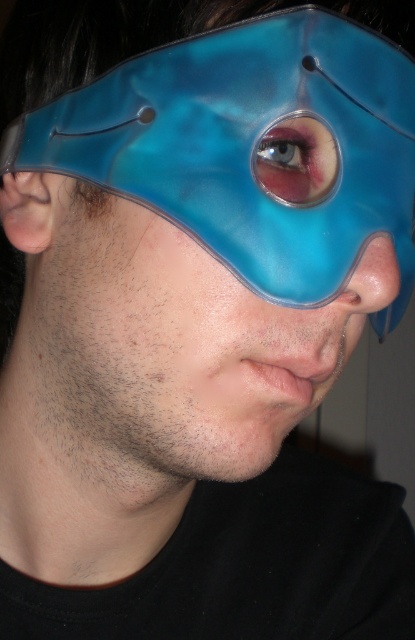
Question: Which point is farther to the camera?

Choices:
 (A) purple glossy eye at center
 (B) transparent blue mask at upper right

Answer: (A)

Question: Does transparent blue mask at upper right appear under purple glossy eye at center?

Choices:
 (A) yes
 (B) no

Answer: (A)

Question: Which object is farther from the camera taking this photo?

Choices:
 (A) transparent blue mask at upper right
 (B) purple glossy eye at center

Answer: (B)

Question: Among these points, which one is nearest to the camera?

Choices:
 (A) (305, 138)
 (B) (231, 93)

Answer: (B)

Question: Is transparent blue mask at upper right to the right of purple glossy eye at center from the viewer's perspective?

Choices:
 (A) no
 (B) yes

Answer: (A)

Question: Does transparent blue mask at upper right lie behind purple glossy eye at center?

Choices:
 (A) yes
 (B) no

Answer: (B)